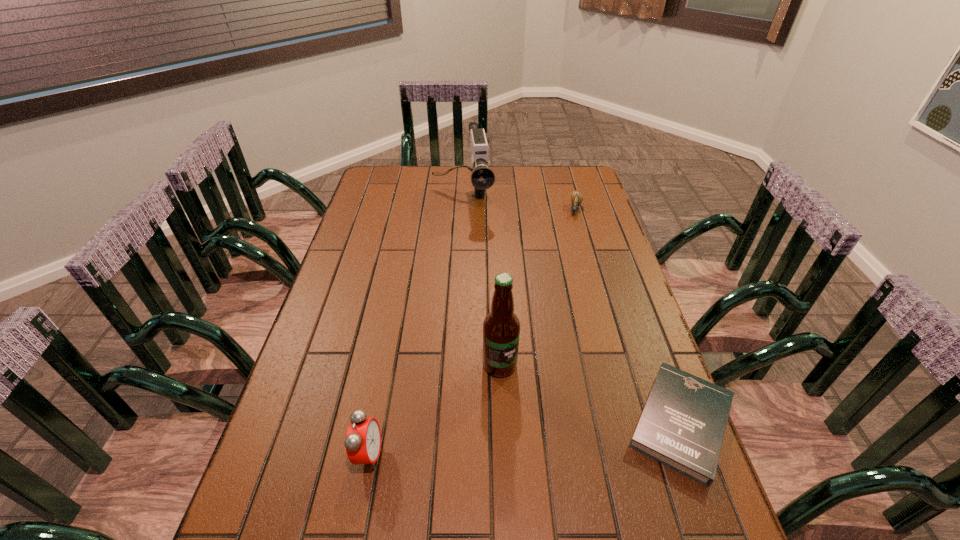
Choose which object is the third nearest neighbor to the third tallest object. Please provide its 2D coordinates. Your answer should be formatted as a tuple, i.e. [(x, y)], where the tuple contains the x and y coordinates of a point satisfying the conditions above.

[(482, 178)]

Where is `vacant space that satisfies the following two spatial constraints: 1. on the front side of the escargot; 2. on the right side of the camcorder`? The image size is (960, 540). vacant space that satisfies the following two spatial constraints: 1. on the front side of the escargot; 2. on the right side of the camcorder is located at coordinates (462, 210).

Where is `vacant space that satisfies the following two spatial constraints: 1. on the front side of the book; 2. on the left side of the beer bottle`? vacant space that satisfies the following two spatial constraints: 1. on the front side of the book; 2. on the left side of the beer bottle is located at coordinates (502, 422).